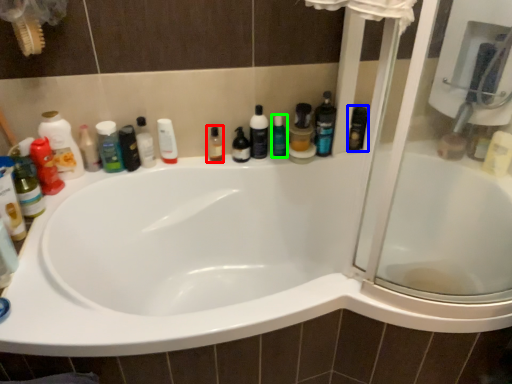
Question: Which object is the farthest from toiletry (highlighted by a red box)? Choose among these: toiletry (highlighted by a blue box) or cleaning product (highlighted by a green box).

Choices:
 (A) toiletry
 (B) cleaning product

Answer: (A)